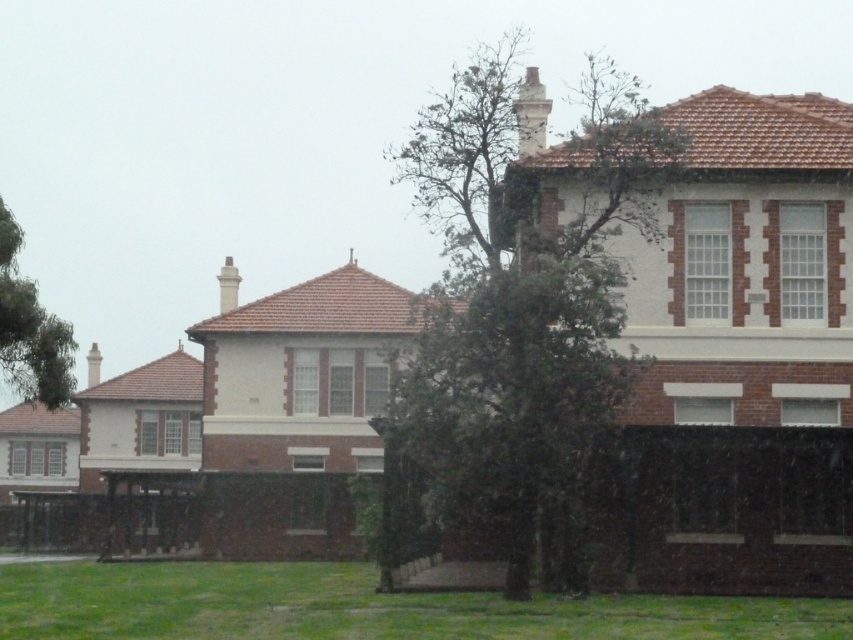
Can you confirm if green leafy tree at center is positioned to the right of green leafy tree at upper left?

Yes, green leafy tree at center is to the right of green leafy tree at upper left.

Is green leafy tree at center in front of green leafy tree at upper left?

That is True.

At what (x,y) coordinates should I click in order to perform the action: click on green leafy tree at center. Please return your answer as a coordinate pair (x, y). This screenshot has width=853, height=640. Looking at the image, I should click on (519, 307).

In order to click on green leafy tree at center in this screenshot , I will do tap(519, 307).

Does green grass at lower center have a larger size compared to green leafy tree at upper left?

Indeed, green grass at lower center has a larger size compared to green leafy tree at upper left.

Who is higher up, green grass at lower center or green leafy tree at upper left?

green leafy tree at upper left is higher up.

Who is more forward, (593,612) or (73,340)?

Point (593,612) is more forward.

The height and width of the screenshot is (640, 853). I want to click on green grass at lower center, so click(363, 608).

Who is shorter, green leafy tree at center or green grass at lower center?

green grass at lower center is shorter.

Does green leafy tree at center appear under green grass at lower center?

Actually, green leafy tree at center is above green grass at lower center.

Does point (544, 305) lie in front of point (54, 570)?

Yes, point (544, 305) is in front of point (54, 570).

Image resolution: width=853 pixels, height=640 pixels. Identify the location of green leafy tree at center. (519, 307).